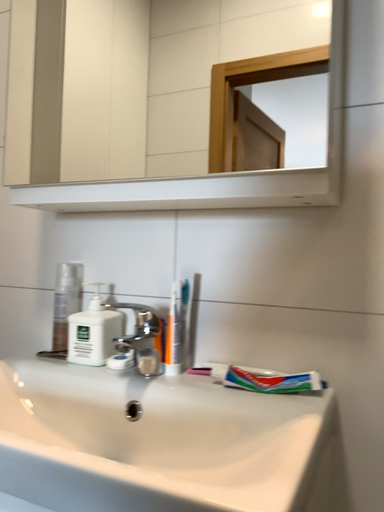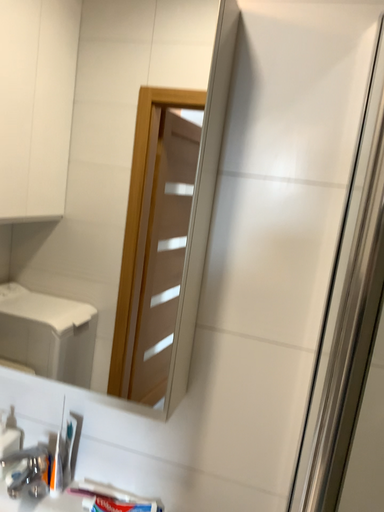
Question: How did the camera likely rotate when shooting the video?

Choices:
 (A) rotated left
 (B) rotated right

Answer: (B)